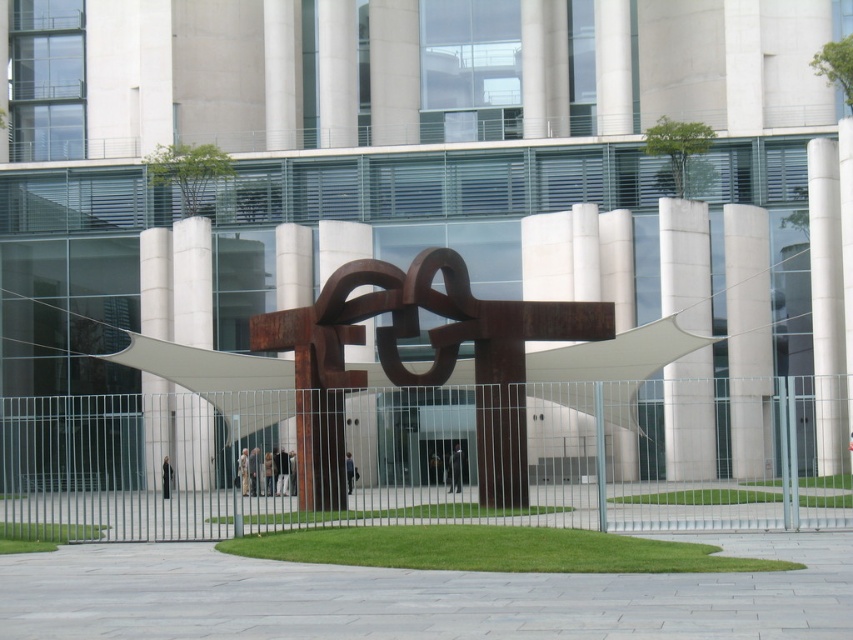
Question: Can you confirm if white smooth pillar at center is positioned to the right of white smooth pillar at right?

Choices:
 (A) no
 (B) yes

Answer: (A)

Question: Can you confirm if rusty metal sculpture at center is smaller than satin white column at center?

Choices:
 (A) no
 (B) yes

Answer: (A)

Question: Is rusty metal sculpture at center bigger than white smooth pillar at left?

Choices:
 (A) yes
 (B) no

Answer: (A)

Question: Which point is farther to the camera?

Choices:
 (A) (627, 301)
 (B) (49, 500)

Answer: (A)

Question: Considering the real-world distances, which object is farthest from the rustic metal pillar at center?

Choices:
 (A) metallic silver fence at center
 (B) satin white column at center
 (C) rusty metal sculpture at center
 (D) white smooth pillar at center

Answer: (A)

Question: Among these objects, which one is nearest to the camera?

Choices:
 (A) white concrete pillar at center
 (B) white smooth pillar at right
 (C) satin white column at center

Answer: (A)